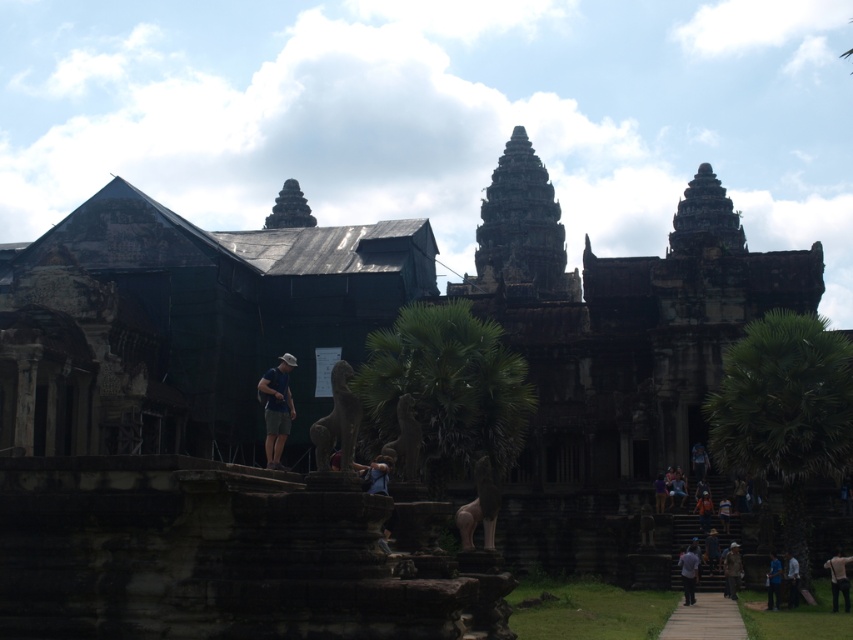
Does light brown fabric shirt at lower right have a lesser width compared to brown leather jacket at lower right?

In fact, light brown fabric shirt at lower right might be wider than brown leather jacket at lower right.

How distant is light brown fabric shirt at lower right from brown leather jacket at lower right?

light brown fabric shirt at lower right and brown leather jacket at lower right are 4.40 meters apart.

Does point (843, 572) come behind point (733, 582)?

No, (843, 572) is closer to viewer.

Where is `light brown fabric shirt at lower right`? Image resolution: width=853 pixels, height=640 pixels. light brown fabric shirt at lower right is located at coordinates (838, 579).

Who is positioned more to the right, brown leather jacket at lower right or light blue shirt at lower right?

Positioned to the right is light blue shirt at lower right.

Which is below, brown leather jacket at lower right or light blue shirt at lower right?

Positioned lower is brown leather jacket at lower right.

Which is behind, point (728, 564) or point (790, 577)?

The point (728, 564) is behind.

Find the location of `brown leather jacket at lower right`. brown leather jacket at lower right is located at coordinates (732, 568).

Between light brown fabric shirt at lower right and gray fabric shirt at lower right, which one appears on the right side from the viewer's perspective?

light brown fabric shirt at lower right is more to the right.

Between light brown fabric shirt at lower right and gray fabric shirt at lower right, which one is positioned lower?

gray fabric shirt at lower right is below.

Which is in front, point (831, 568) or point (685, 579)?

Point (831, 568) is in front.

Where is `light brown fabric shirt at lower right`? The width and height of the screenshot is (853, 640). light brown fabric shirt at lower right is located at coordinates (838, 579).